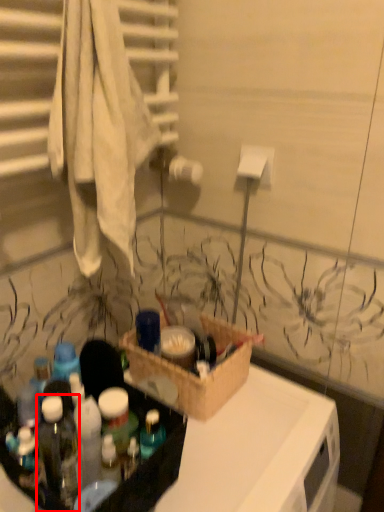
Question: From the image's perspective, where is bottle (annotated by the red box) located in relation to box in the image?

Choices:
 (A) below
 (B) above

Answer: (A)